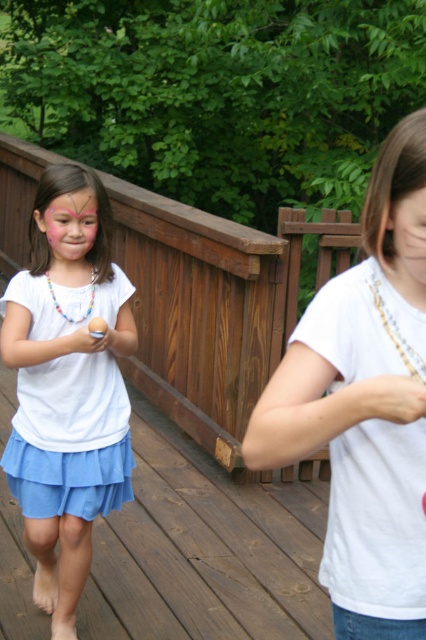
Question: Among these objects, which one is farthest from the camera?

Choices:
 (A) multicolored beaded necklace at left
 (B) white matte shirt at center

Answer: (A)

Question: Does white matte shirt at center lie behind white matte hand at center?

Choices:
 (A) no
 (B) yes

Answer: (B)

Question: Which of the following is the farthest from the observer?

Choices:
 (A) (106, 346)
 (B) (62, 451)

Answer: (B)

Question: Which point is closer to the camera taking this photo?

Choices:
 (A) (394, 198)
 (B) (94, 344)
 (C) (92, 282)

Answer: (A)

Question: Is white matte shirt at center behind multicolored beaded necklace at left?

Choices:
 (A) no
 (B) yes

Answer: (A)

Question: Is white matte shirt at center above light blue chiffon skirt at left?

Choices:
 (A) no
 (B) yes

Answer: (B)